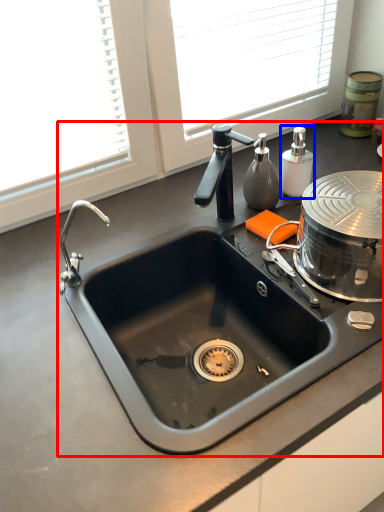
Question: Which object appears farthest to the camera in this image, sink (highlighted by a red box) or soap dispenser (highlighted by a blue box)?

Choices:
 (A) sink
 (B) soap dispenser

Answer: (B)